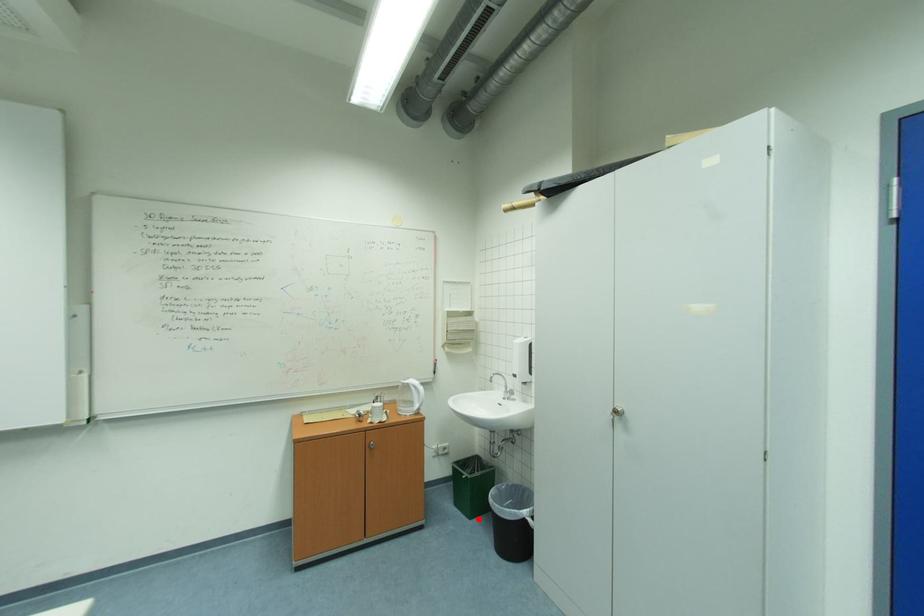
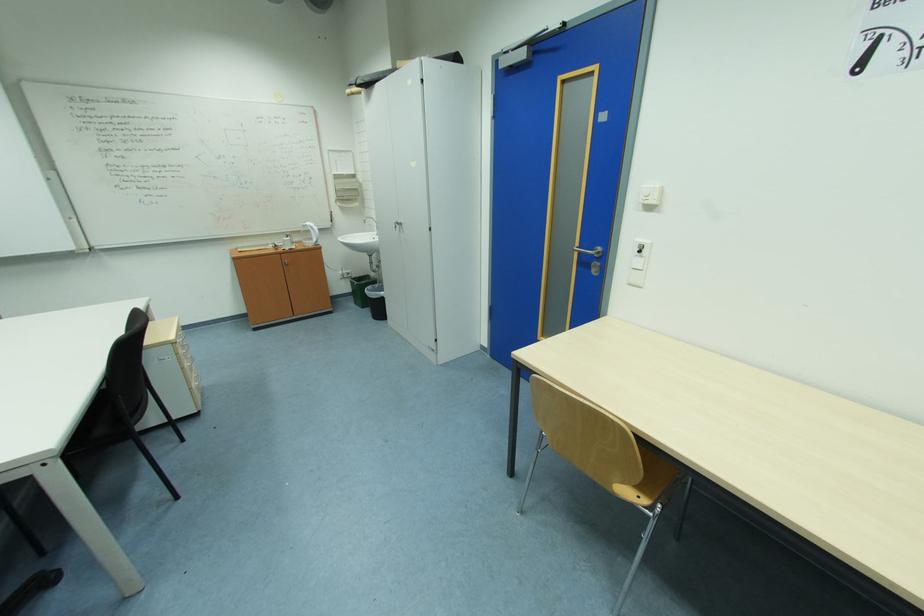
Question: I am providing you with two images of the same scene from different viewpoints. A red point is marked on the first image. At the location where the point appears in image 1, is it still visible in image 2?

Choices:
 (A) Yes
 (B) No

Answer: (A)